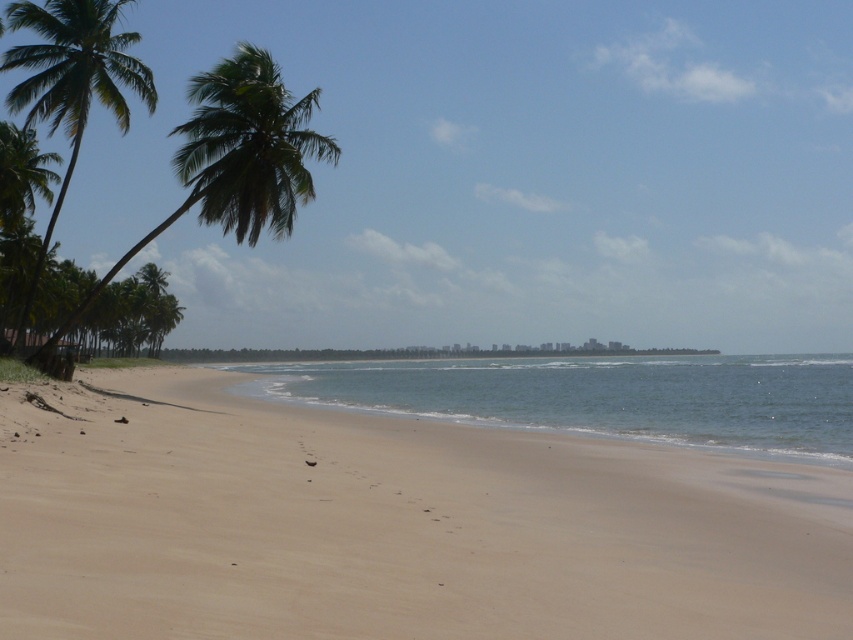
Question: Among these points, which one is farthest from the camera?

Choices:
 (A) (659, 410)
 (B) (120, 81)

Answer: (A)

Question: Does beige sand at lower center appear under blue water at center?

Choices:
 (A) yes
 (B) no

Answer: (B)

Question: Which point is closer to the camera?

Choices:
 (A) blue water at center
 (B) green leafy palm tree at left
 (C) beige sand at lower center

Answer: (C)

Question: Can you confirm if beige sand at lower center is bigger than blue water at center?

Choices:
 (A) yes
 (B) no

Answer: (B)

Question: Is beige sand at lower center smaller than green leafy palm tree at left?

Choices:
 (A) no
 (B) yes

Answer: (B)

Question: Which point appears farthest from the camera in this image?

Choices:
 (A) (515, 369)
 (B) (119, 61)

Answer: (A)